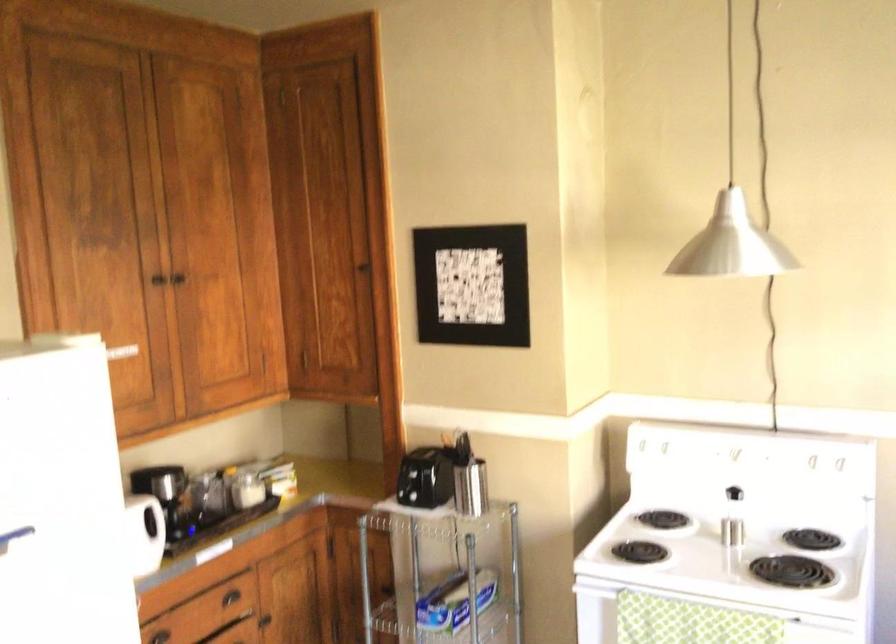
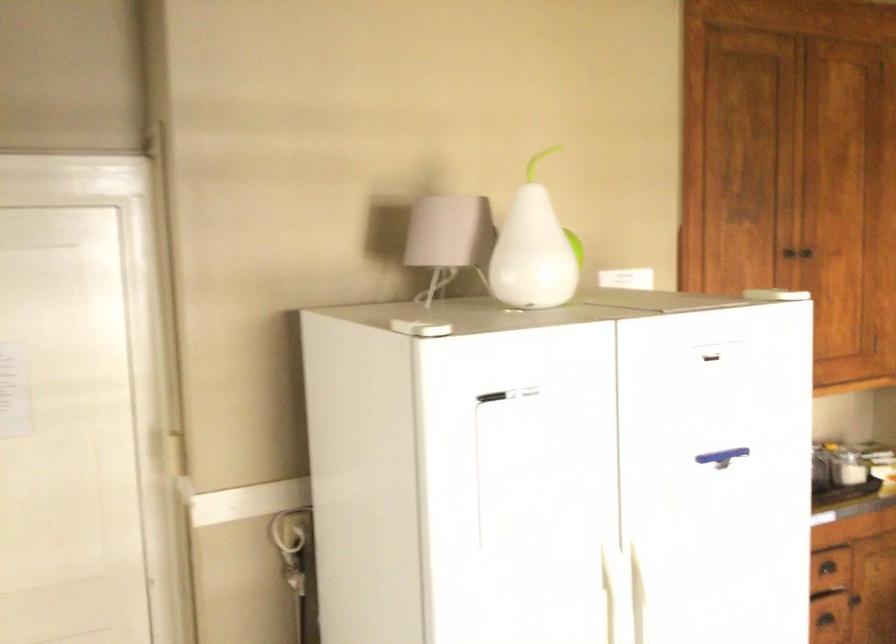
Find the pixel in the second image that matches the point at 148,276 in the first image.

(786, 257)